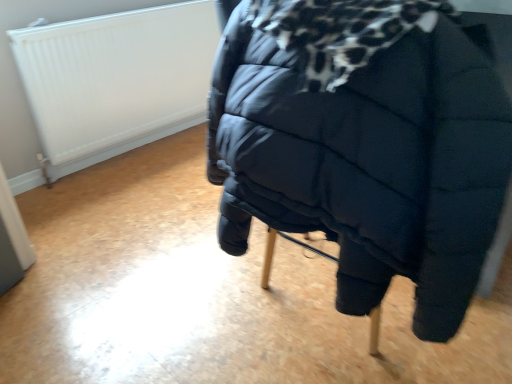
Question: Can you confirm if white textured radiator at upper left is smaller than black quilted bed at center?

Choices:
 (A) no
 (B) yes

Answer: (B)

Question: From the image's perspective, would you say white textured radiator at upper left is positioned over black quilted bed at center?

Choices:
 (A) no
 (B) yes

Answer: (B)

Question: Is white textured radiator at upper left bigger than black quilted bed at center?

Choices:
 (A) no
 (B) yes

Answer: (A)

Question: Is white textured radiator at upper left not close to black quilted bed at center?

Choices:
 (A) no
 (B) yes

Answer: (B)

Question: From the image's perspective, does white textured radiator at upper left appear lower than black quilted bed at center?

Choices:
 (A) no
 (B) yes

Answer: (A)

Question: Is white textured radiator at upper left touching black quilted bed at center?

Choices:
 (A) no
 (B) yes

Answer: (A)

Question: Could you tell me if black quilted bed at center is facing white textured radiator at upper left?

Choices:
 (A) yes
 (B) no

Answer: (B)

Question: Is black quilted bed at center next to white textured radiator at upper left and touching it?

Choices:
 (A) no
 (B) yes

Answer: (A)

Question: From the image's perspective, is black quilted bed at center beneath white textured radiator at upper left?

Choices:
 (A) yes
 (B) no

Answer: (A)

Question: Considering the relative positions of black quilted bed at center and white textured radiator at upper left in the image provided, is black quilted bed at center behind white textured radiator at upper left?

Choices:
 (A) no
 (B) yes

Answer: (A)

Question: Would you say black quilted bed at center is a long distance from white textured radiator at upper left?

Choices:
 (A) no
 (B) yes

Answer: (B)

Question: Does black quilted bed at center have a lesser height compared to white textured radiator at upper left?

Choices:
 (A) no
 (B) yes

Answer: (B)

Question: Is white textured radiator at upper left bigger or smaller than black quilted bed at center?

Choices:
 (A) small
 (B) big

Answer: (A)